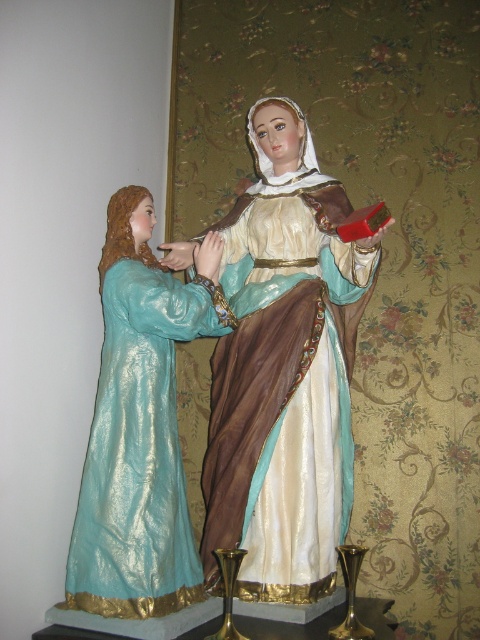
You are an interior designer planning to place a new decorative item between the silky brown dress at center and the shiny teal dress at left. Given their sizes, which dress will require more space to accommodate the new item?

The silky brown dress at center is larger in size than the shiny teal dress at left, so it will require more space to accommodate the new item.

You are an interior designer planning to place a new decorative item between the two statues. The statues are positioned against a wall with floral wallpaper. You want to ensure the item is centered between them. Given the coordinates of the silky brown dress at center as point (285,387), where should you place the new item?

The new decorative item should be placed at the coordinates of the silky brown dress at center, which is point (285,387), as it is already centered between the two statues.

You are an interior designer arranging a gallery wall. You need to place a new artwork between the silky brown dress at center and the shiny teal dress at left. Based on their positions, which dress should be on the left side of the new artwork?

The shiny teal dress at left should be on the left side of the new artwork because the silky brown dress at center is to the right of it, meaning the teal dress is already positioned to the left of the brown dress.